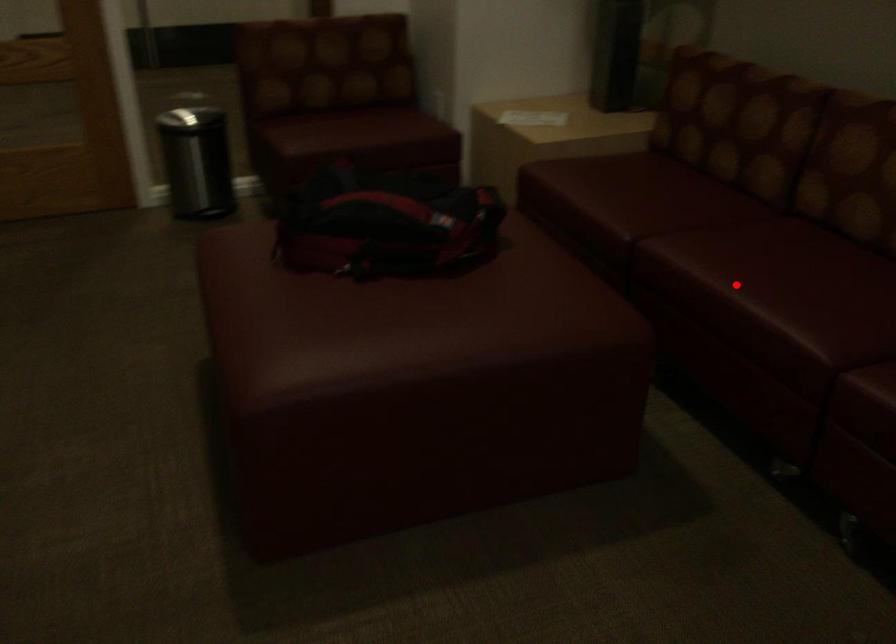
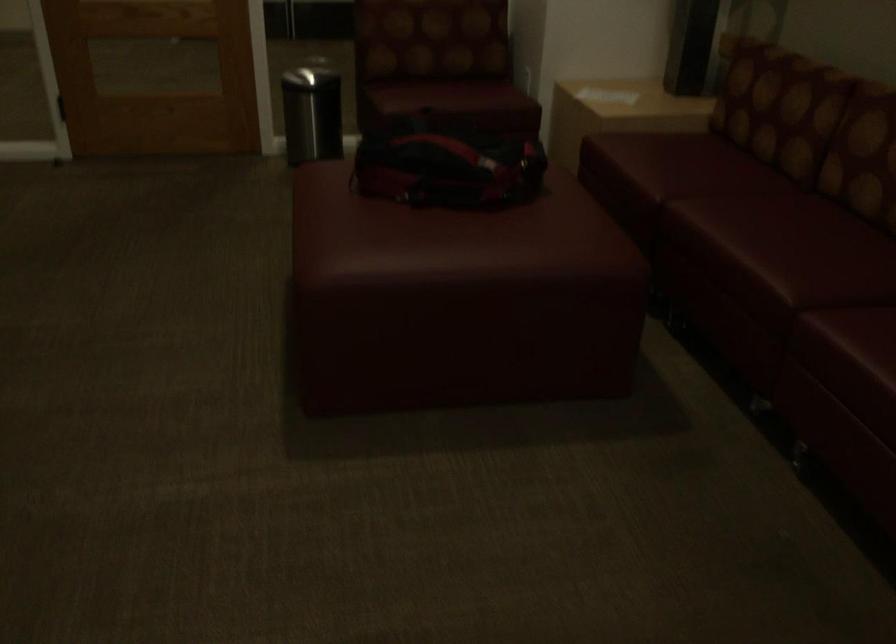
Question: I am providing you with two images of the same scene from different viewpoints. In image1, a red point is highlighted. Considering the same 3D point in image2, which of the following is correct?

Choices:
 (A) It is closer
 (B) It is farther

Answer: (B)